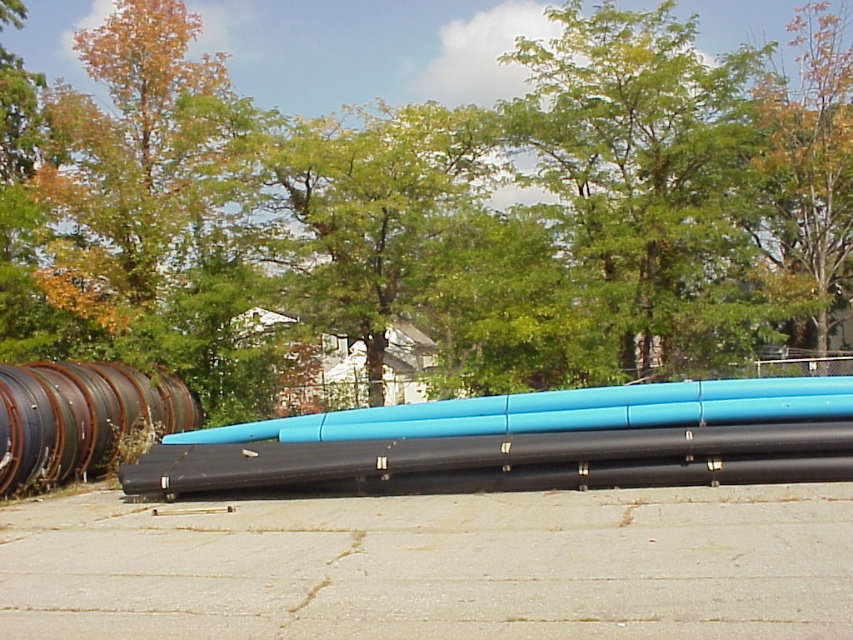
Can you confirm if blue matte pipe at center is smaller than rusty metal barrel at left?

Yes, blue matte pipe at center is smaller than rusty metal barrel at left.

How distant is blue matte pipe at center from rusty metal barrel at left?

They are 7.60 meters apart.

This screenshot has height=640, width=853. Describe the element at coordinates (560, 412) in the screenshot. I see `blue matte pipe at center` at that location.

Locate an element on the screen. This screenshot has width=853, height=640. blue matte pipe at center is located at coordinates (560, 412).

Find the location of `green leafy tree at upper center`. green leafy tree at upper center is located at coordinates (430, 205).

This screenshot has width=853, height=640. What do you see at coordinates (430, 205) in the screenshot?
I see `green leafy tree at upper center` at bounding box center [430, 205].

Between point (378, 291) and point (807, 173), which one is positioned behind?

The point (378, 291) is behind.

Identify the location of green leafy tree at upper center. This screenshot has width=853, height=640. (430, 205).

Which of these two, green leafy tree at upper center or blue matte pipe at center, stands taller?

green leafy tree at upper center is taller.

Consider the image. Does green leafy tree at upper center lie in front of blue matte pipe at center?

No, green leafy tree at upper center is behind blue matte pipe at center.

Between point (618, 353) and point (618, 426), which one is positioned in front?

Positioned in front is point (618, 426).

The height and width of the screenshot is (640, 853). I want to click on green leafy tree at upper center, so click(430, 205).